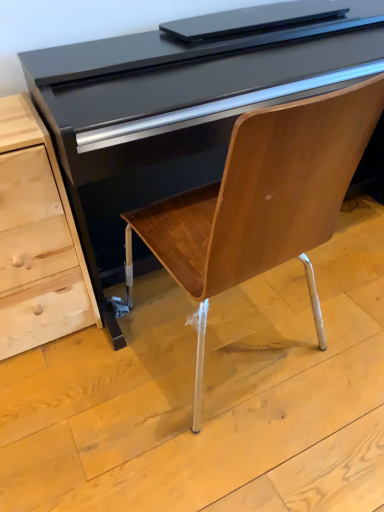
In order to click on vacant area that is in front of glossy black piano at center in this screenshot , I will do `click(231, 456)`.